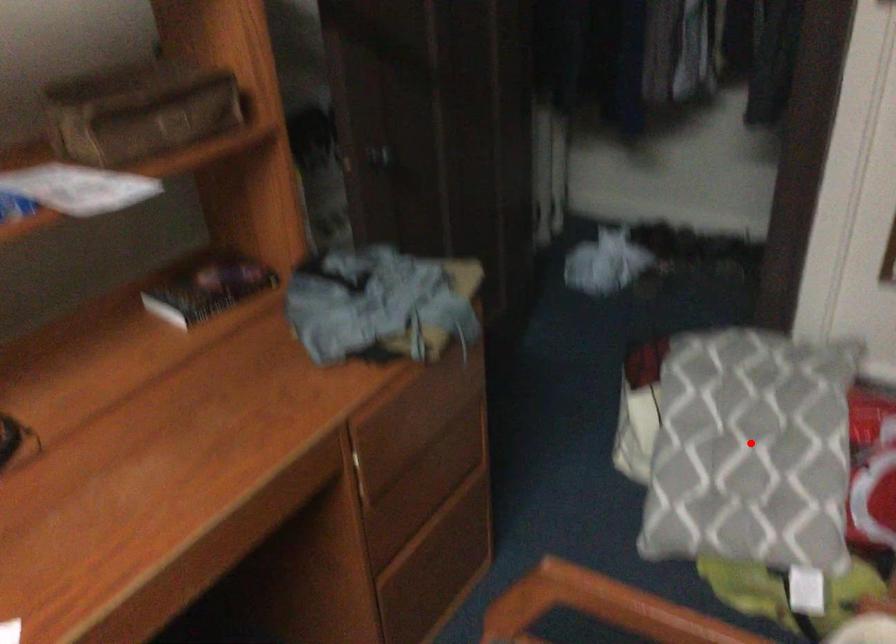
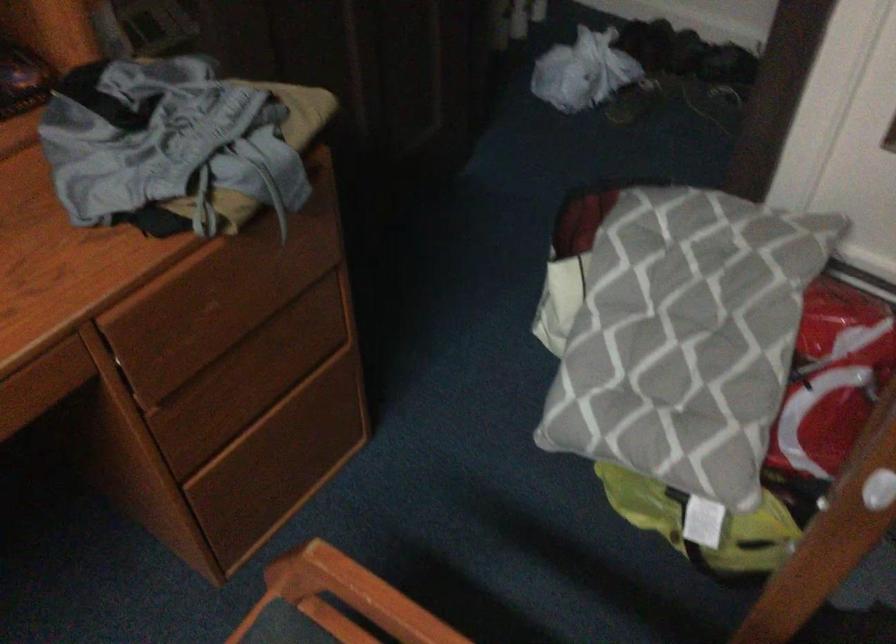
Question: I am providing you with two images of the same scene from different viewpoints. Image1 has a red point marked. In image2, the corresponding 3D location appears at what relative position? Reply with the corresponding letter.

Choices:
 (A) Closer
 (B) Farther

Answer: (A)